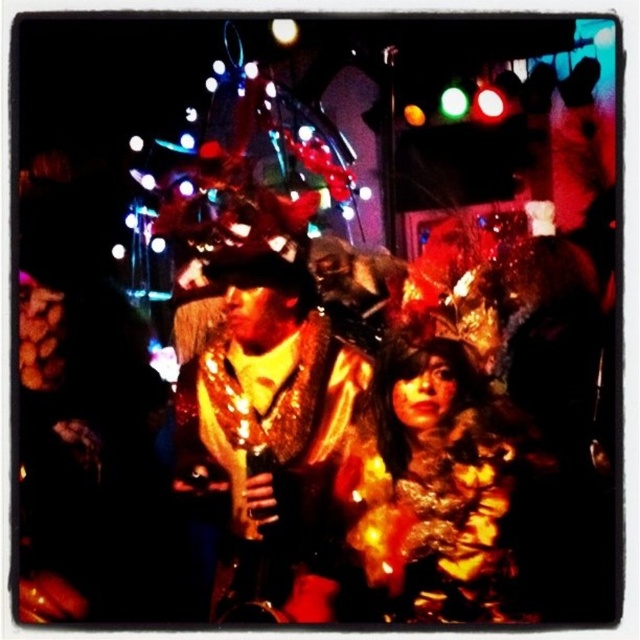
You are at a party and want to take a photo of both the shiny gold jacket at center and the fuzzy fur coat at center. Since you can only focus on one at a time, which one should you focus on to ensure the other is still somewhat visible in the background?

You should focus on the shiny gold jacket at center because the fuzzy fur coat at center is behind it, so focusing on the front object will keep the background one somewhat visible.

You are a photographer at this event and want to take a photo of both the shiny gold jacket at center and the fuzzy fur coat at center. Since you need to ensure both are visible, which one should you focus on first to make sure it appears sharp in the photo?

The shiny gold jacket at center is positioned over fuzzy fur coat at center, so you should focus on the shiny gold jacket at center first to ensure it appears sharp in the photo.

You are a photographer at the event and need to capture a photo of both the shiny gold jacket at center and the fuzzy fur coat at center. Since the camera can only focus on one object at a time, which one should you focus on to ensure it appears larger in the photo?

The shiny gold jacket at center is bigger than the fuzzy fur coat at center, so focusing on the shiny gold jacket at center will make it appear larger in the photo.